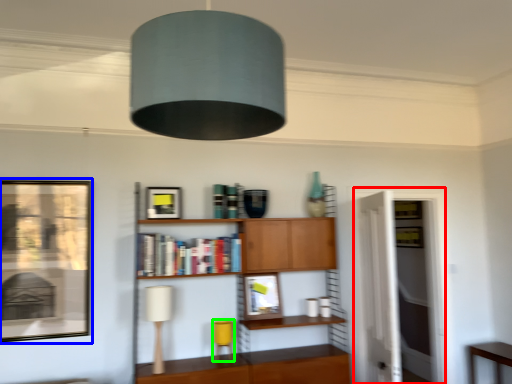
Question: Estimate the real-world distances between objects in this image. Which object is closer to glass door (highlighted by a red box), picture frame (highlighted by a blue box) or table lamp (highlighted by a green box)?

Choices:
 (A) picture frame
 (B) table lamp

Answer: (B)